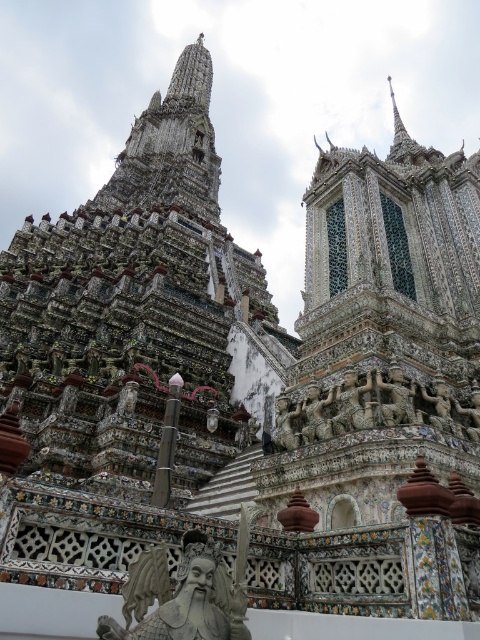
Is point (240, 525) closer to camera compared to point (407, 413)?

Yes.

Who is lower down, gray stone statue at lower center or carved stone figures at center?

Positioned lower is gray stone statue at lower center.

Between point (136, 596) and point (394, 360), which one is positioned in front?

Point (136, 596)

The height and width of the screenshot is (640, 480). In order to click on gray stone statue at lower center in this screenshot , I will do pos(184,593).